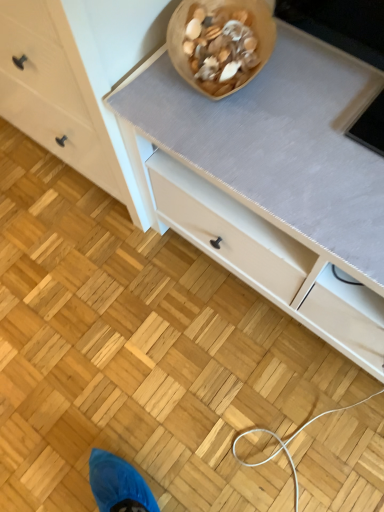
The image size is (384, 512). In order to click on vacant space in front of wooden bowl at upper center in this screenshot , I will do `click(256, 137)`.